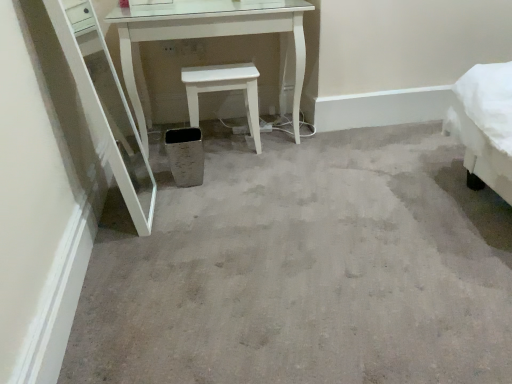
Question: Is white matte stool at center located outside metallic gray trash bin/can at center?

Choices:
 (A) yes
 (B) no

Answer: (A)

Question: Can you confirm if white matte stool at center is shorter than metallic gray trash bin/can at center?

Choices:
 (A) no
 (B) yes

Answer: (A)

Question: Is white matte stool at center touching metallic gray trash bin/can at center?

Choices:
 (A) yes
 (B) no

Answer: (B)

Question: Considering the relative sizes of white matte stool at center and metallic gray trash bin/can at center in the image provided, is white matte stool at center smaller than metallic gray trash bin/can at center?

Choices:
 (A) yes
 (B) no

Answer: (B)

Question: Does white matte stool at center have a larger size compared to metallic gray trash bin/can at center?

Choices:
 (A) no
 (B) yes

Answer: (B)

Question: Is white matte stool at center not close to metallic gray trash bin/can at center?

Choices:
 (A) no
 (B) yes

Answer: (A)

Question: Is metallic gray trash bin/can at center surrounding white matte stool at center?

Choices:
 (A) no
 (B) yes

Answer: (A)

Question: Does metallic gray trash bin/can at center touch white matte stool at center?

Choices:
 (A) yes
 (B) no

Answer: (B)

Question: From the image's perspective, does metallic gray trash bin/can at center appear lower than white matte stool at center?

Choices:
 (A) no
 (B) yes

Answer: (B)

Question: Does metallic gray trash bin/can at center turn towards white matte stool at center?

Choices:
 (A) no
 (B) yes

Answer: (A)

Question: From a real-world perspective, is metallic gray trash bin/can at center located beneath white matte stool at center?

Choices:
 (A) yes
 (B) no

Answer: (A)

Question: Can you confirm if metallic gray trash bin/can at center is positioned to the left of white matte stool at center?

Choices:
 (A) no
 (B) yes

Answer: (B)

Question: In terms of height, does metallic gray trash bin/can at center look taller or shorter compared to white matte stool at center?

Choices:
 (A) tall
 (B) short

Answer: (B)